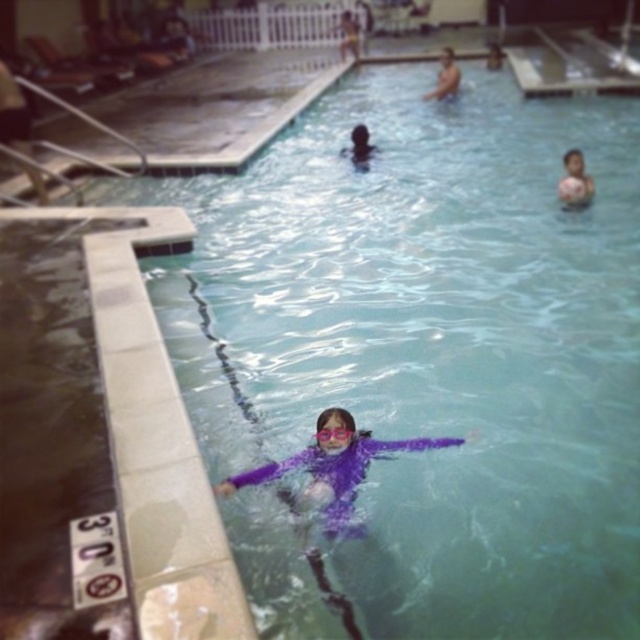
You are a lifeguard on duty and need to ensure all flotation devices are properly placed. The purple rubber at upper right and the smooth skin head at upper center are both in your line of sight. Which object is closer to the water surface?

The purple rubber at upper right is shorter than the smooth skin head at upper center, so the purple rubber at upper right is closer to the water surface.

You are a lifeguard standing at the edge of the pool. You need to determine if the smooth skin person at upper center is above the purple plastic goggles at center. Can you confirm this?

Yes, the smooth skin person at upper center is located above the purple plastic goggles at center according to the description.